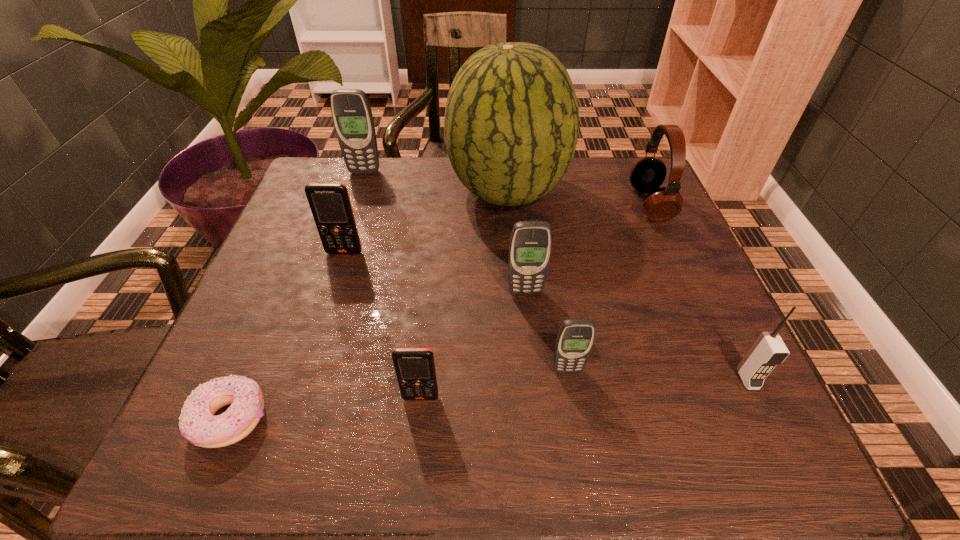
Image resolution: width=960 pixels, height=540 pixels. I want to click on doughnut located at the left edge, so click(x=198, y=425).

At what (x,y) coordinates should I click in order to perform the action: click on headset at the right edge. Please return your answer as a coordinate pair (x, y). Looking at the image, I should click on (647, 174).

Where is `cellular telephone that is at the right edge`? This screenshot has width=960, height=540. cellular telephone that is at the right edge is located at coordinates (769, 350).

Find the location of a particular element. This screenshot has height=540, width=960. object that is at the far left corner is located at coordinates pyautogui.click(x=351, y=112).

In order to click on object that is at the near left corner in this screenshot , I will do `click(198, 425)`.

Locate an element on the screen. The height and width of the screenshot is (540, 960). object present at the far right corner is located at coordinates [647, 174].

At what (x,y) coordinates should I click in order to perform the action: click on free space at the far edge of the desktop. Please return your answer as a coordinate pair (x, y). This screenshot has height=540, width=960. Looking at the image, I should click on point(435,158).

In the image, there is a desktop. Identify the location of vacant space at the near edge. (388, 464).

Find the location of a particular element. Image resolution: width=960 pixels, height=540 pixels. free space at the left edge is located at coordinates (293, 234).

Locate an element on the screen. The image size is (960, 540). vacant space at the right edge of the desktop is located at coordinates (706, 283).